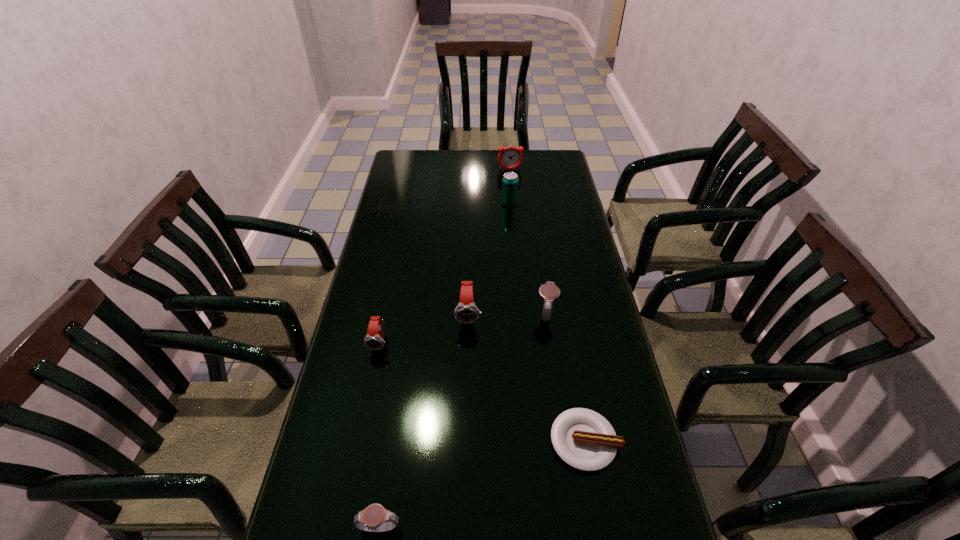
This screenshot has height=540, width=960. In order to click on watch present at the right edge in this screenshot , I will do pos(549,291).

Identify the location of sausage that is at the right edge. (584, 439).

In the image, there is a desktop. Where is `free space at the far edge`? Image resolution: width=960 pixels, height=540 pixels. free space at the far edge is located at coordinates (436, 164).

In the image, there is a desktop. Where is `vacant area at the left edge`? The height and width of the screenshot is (540, 960). vacant area at the left edge is located at coordinates (412, 251).

Find the location of a particular element. This screenshot has height=540, width=960. free location at the right edge is located at coordinates (564, 287).

Locate an element on the screen. The width and height of the screenshot is (960, 540). vacant region at the far left corner is located at coordinates (398, 152).

Find the location of a particular element. vacant space at the far right corner of the desktop is located at coordinates point(539,150).

The image size is (960, 540). I want to click on free space between the sausage and the fifth object from right to left, so click(527, 377).

Find the location of a particular element. The image size is (960, 540). empty space that is in between the farther gray watch and the fifth object from right to left is located at coordinates (507, 314).

The height and width of the screenshot is (540, 960). What are the coordinates of `object identified as the fourth closest to the leftmost object` in the screenshot? It's located at (584, 439).